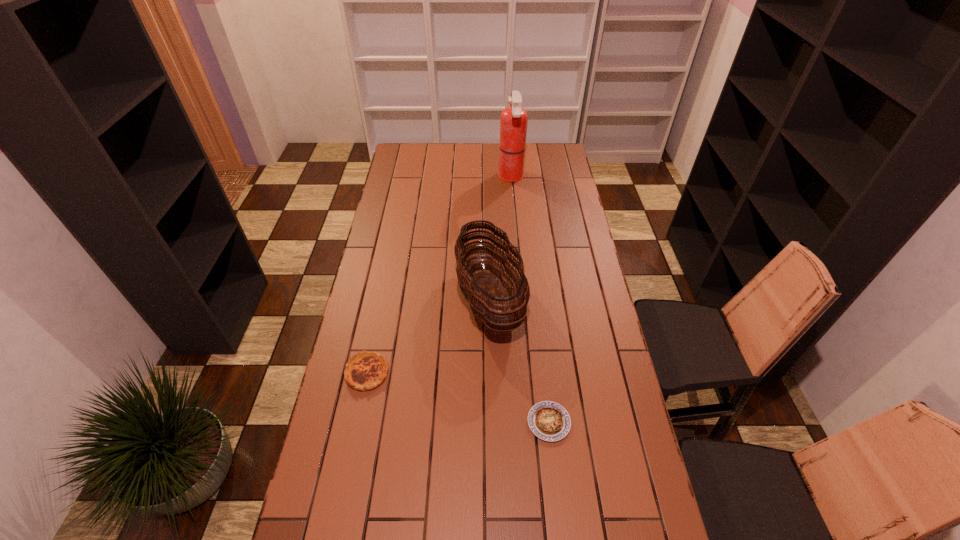
The height and width of the screenshot is (540, 960). What are the coordinates of `vacant space located 0.340m with the handle and hose on the farthest object` in the screenshot? It's located at (430, 177).

Identify the location of vacant region located 0.170m on the right of the basket. (570, 300).

Locate an element on the screen. The image size is (960, 540). vacant space located on the right of the second shortest object is located at coordinates (479, 373).

I want to click on free space located on the back of the right quiche, so click(x=540, y=343).

Identify the location of object positioned at the far edge. (513, 122).

Find the location of `object that is positioned at the left edge`. object that is positioned at the left edge is located at coordinates (365, 370).

What are the coordinates of `vacant space at the far edge` in the screenshot? It's located at (444, 151).

In the image, there is a desktop. Identify the location of vacant space at the left edge. The width and height of the screenshot is (960, 540). (406, 174).

In order to click on free space at the right edge of the desktop in this screenshot , I will do `click(591, 412)`.

Where is `free space at the far left corner of the desktop`? The width and height of the screenshot is (960, 540). free space at the far left corner of the desktop is located at coordinates (395, 156).